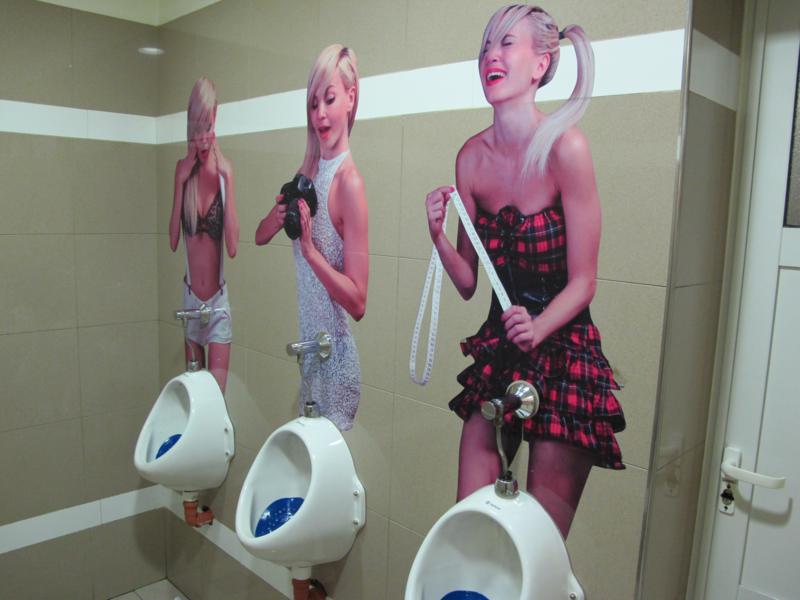
At what (x,y) coordinates should I click in order to perform the action: click on door handle. Please return your answer as a coordinate pair (x, y). Looking at the image, I should click on (729, 472).